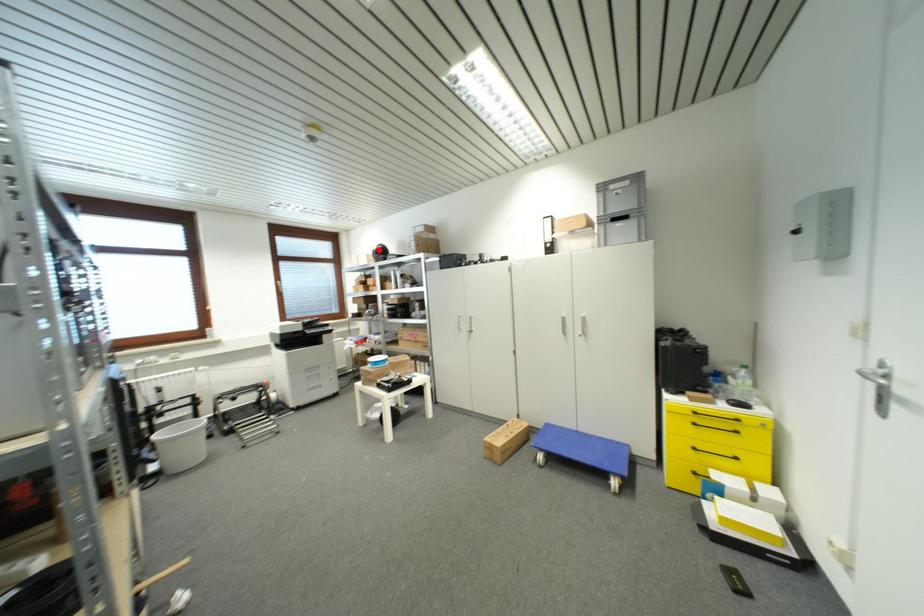
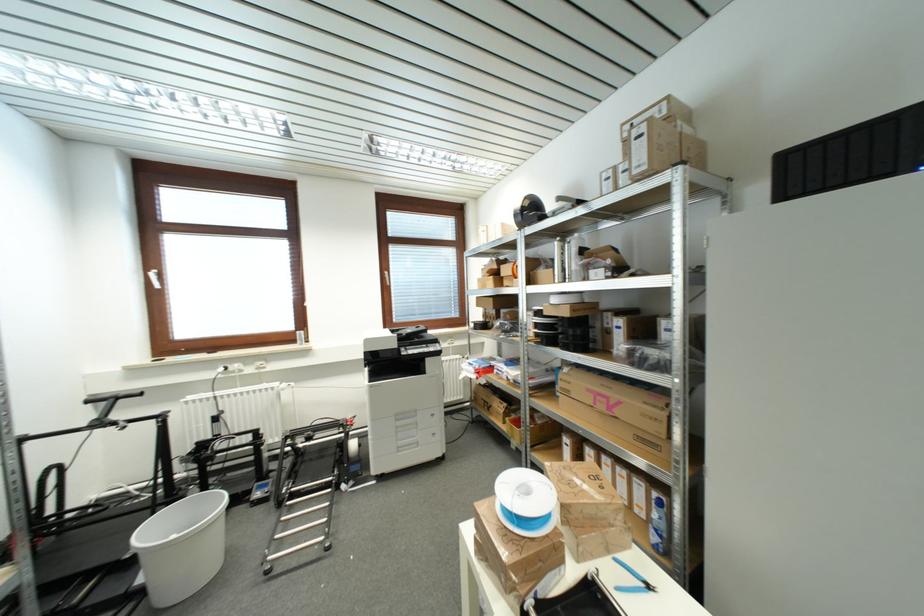
Question: A red point is marked in image1. In image2, is the corresponding 3D point closer to the camera or farther? Reply with the corresponding letter.

Choices:
 (A) The corresponding 3D point is closer.
 (B) The corresponding 3D point is farther.

Answer: (B)